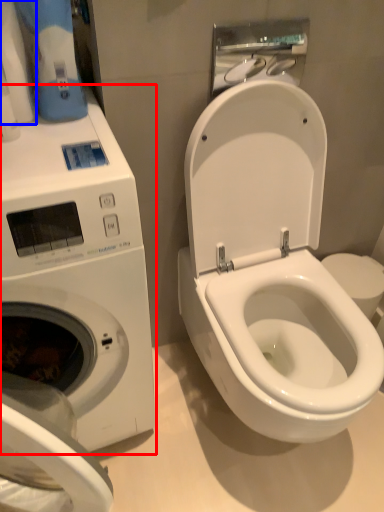
Question: Among these objects, which one is farthest to the camera, washing machine (highlighted by a red box) or toilet paper (highlighted by a blue box)?

Choices:
 (A) washing machine
 (B) toilet paper

Answer: (B)